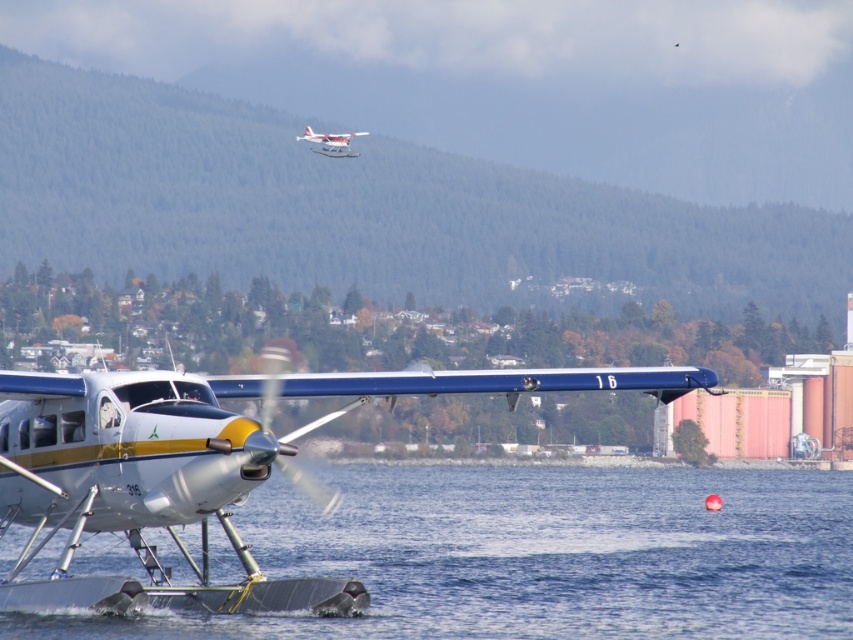
Between white glossy seaplane at center and white matte airplane at upper center, which one appears on the left side from the viewer's perspective?

From the viewer's perspective, white matte airplane at upper center appears more on the left side.

Is white glossy seaplane at center positioned behind white matte airplane at upper center?

No.

The image size is (853, 640). I want to click on white glossy seaplane at center, so click(x=202, y=468).

Can you confirm if white matte water at lower center is thinner than white glossy seaplane at center?

No, white matte water at lower center is not thinner than white glossy seaplane at center.

Can you confirm if white matte water at lower center is positioned to the right of white glossy seaplane at center?

Yes, white matte water at lower center is to the right of white glossy seaplane at center.

The height and width of the screenshot is (640, 853). Find the location of `white matte water at lower center`. white matte water at lower center is located at coordinates (541, 556).

Find the location of `white matte water at lower center`. white matte water at lower center is located at coordinates (541, 556).

How far apart are white matte water at lower center and white matte airplane at upper center?

white matte water at lower center is 41.79 meters away from white matte airplane at upper center.

Which is behind, point (836, 552) or point (347, 147)?

Point (347, 147)

Does point (659, 568) come closer to viewer compared to point (366, 132)?

Yes.

Where is `white matte water at lower center`? white matte water at lower center is located at coordinates (541, 556).